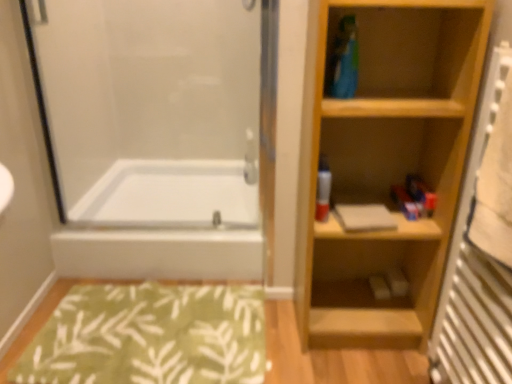
I want to click on wooden radiator at right, so click(481, 250).

This screenshot has width=512, height=384. What do you see at coordinates (156, 135) in the screenshot?
I see `transparent glass screen door at left` at bounding box center [156, 135].

Describe the element at coordinates (150, 335) in the screenshot. I see `green fabric bath mat at lower left` at that location.

You are a GUI agent. You are given a task and a screenshot of the screen. Output one action in this format:
    pyautogui.click(x=<x>, y=<y>)
    Task: Click on the matte gray book at center
    
    Given the screenshot: What is the action you would take?
    pyautogui.click(x=364, y=217)

Considering the sizes of objects transparent glass screen door at left and white textured towel at right in the image provided, who is taller, transparent glass screen door at left or white textured towel at right?

With more height is transparent glass screen door at left.

Is transparent glass screen door at left in front of white textured towel at right?

No.

From the image's perspective, relative to white textured towel at right, is transparent glass screen door at left above or below?

transparent glass screen door at left is above white textured towel at right.

Which is more to the left, transparent glass screen door at left or white textured towel at right?

From the viewer's perspective, transparent glass screen door at left appears more on the left side.

Consider the image. Can you confirm if white textured towel at right is thinner than light wood bookshelf at right?

Yes.

Find the location of a particular element. This screenshot has height=384, width=512. bath towel in front of the light wood bookshelf at right is located at coordinates (495, 186).

Considering the relative sizes of white textured towel at right and light wood bookshelf at right in the image provided, is white textured towel at right smaller than light wood bookshelf at right?

Yes, white textured towel at right is smaller than light wood bookshelf at right.

Who is more distant, white textured towel at right or light wood bookshelf at right?

light wood bookshelf at right is more distant.

Considering the relative positions of white glossy bathtub at lower left and matte plastic spray can at center in the image provided, is white glossy bathtub at lower left to the left of matte plastic spray can at center from the viewer's perspective?

Yes.

Between point (83, 263) and point (330, 183), which one is positioned behind?

Positioned behind is point (83, 263).

Considering their positions, is light wood bookshelf at right located in front of or behind matte plastic spray can at center?

Visually, light wood bookshelf at right is located in front of matte plastic spray can at center.

From the image's perspective, is light wood bookshelf at right located above matte plastic spray can at center?

No, from the image's perspective, light wood bookshelf at right is not over matte plastic spray can at center.

In terms of size, does light wood bookshelf at right appear bigger or smaller than matte plastic spray can at center?

light wood bookshelf at right is bigger than matte plastic spray can at center.

From the image's perspective, is wooden radiator at right under light wood bookshelf at right?

Yes, from the image's perspective, wooden radiator at right is below light wood bookshelf at right.

Considering the sizes of wooden radiator at right and light wood bookshelf at right in the image, is wooden radiator at right bigger or smaller than light wood bookshelf at right?

Clearly, wooden radiator at right is smaller in size than light wood bookshelf at right.

From a real-world perspective, which object stands above the other?

wooden radiator at right, from a real-world perspective.

The image size is (512, 384). I want to click on radiator below the light wood bookshelf at right (from the image's perspective), so click(481, 250).

Is transparent glass screen door at left in front of or behind green fabric bath mat at lower left in the image?

transparent glass screen door at left is behind green fabric bath mat at lower left.

From a real-world perspective, is transparent glass screen door at left above or below green fabric bath mat at lower left?

transparent glass screen door at left is situated higher than green fabric bath mat at lower left in the real world.

Is transparent glass screen door at left spatially inside green fabric bath mat at lower left, or outside of it?

transparent glass screen door at left is outside green fabric bath mat at lower left.

Is green fabric bath mat at lower left bigger than matte gray book at center?

Indeed, green fabric bath mat at lower left has a larger size compared to matte gray book at center.

Image resolution: width=512 pixels, height=384 pixels. In order to click on bath mat on the left of matte gray book at center in this screenshot , I will do `click(150, 335)`.

Which object is wider, green fabric bath mat at lower left or matte gray book at center?

green fabric bath mat at lower left.

Are green fabric bath mat at lower left and matte gray book at center making contact?

green fabric bath mat at lower left is not next to matte gray book at center, and they're not touching.

Where is `screen door lying above the white textured towel at right (from the image's perspective)`? The height and width of the screenshot is (384, 512). screen door lying above the white textured towel at right (from the image's perspective) is located at coordinates (156, 135).

Locate an element on the screen. bath towel that is in front of the light wood bookshelf at right is located at coordinates (495, 186).

Based on the photo, when comparing their distances from light wood bookshelf at right, does matte plastic spray can at center or transparent glass screen door at left seem further?

Based on the image, transparent glass screen door at left appears to be further to light wood bookshelf at right.

Estimate the real-world distances between objects in this image. Which object is further from green fabric bath mat at lower left, transparent glass screen door at left or white glossy bathtub at lower left?

The object further to green fabric bath mat at lower left is transparent glass screen door at left.

Looking at the image, which one is located closer to matte gray book at center, white glossy bathtub at lower left or white textured towel at right?

The object closer to matte gray book at center is white textured towel at right.

From the picture: Estimate the real-world distances between objects in this image. Which object is further from matte gray book at center, white glossy bathtub at lower left or matte plastic spray can at center?

white glossy bathtub at lower left is positioned further to the anchor matte gray book at center.

In the scene shown: Looking at the image, which one is located closer to matte gray book at center, white glossy bathtub at lower left or wooden radiator at right?

wooden radiator at right is positioned closer to the anchor matte gray book at center.

Which object lies further to the anchor point white textured towel at right, wooden radiator at right or transparent glass screen door at left?

transparent glass screen door at left is positioned further to the anchor white textured towel at right.

Which object lies nearer to the anchor point transparent glass screen door at left, matte plastic spray can at center or matte gray book at center?

matte plastic spray can at center lies closer to transparent glass screen door at left than the other object.

When comparing their distances from transparent glass screen door at left, does matte gray book at center or green fabric bath mat at lower left seem further?

matte gray book at center.

Where is `book between transparent glass screen door at left and white textured towel at right in the horizontal direction`? The image size is (512, 384). book between transparent glass screen door at left and white textured towel at right in the horizontal direction is located at coordinates (364, 217).

Identify the location of bath towel positioned between wooden radiator at right and matte gray book at center from near to far. The height and width of the screenshot is (384, 512). (495, 186).

The height and width of the screenshot is (384, 512). Find the location of `book between white glossy bathtub at lower left and light wood bookshelf at right`. book between white glossy bathtub at lower left and light wood bookshelf at right is located at coordinates (364, 217).

I want to click on bookshelf between wooden radiator at right and matte gray book at center from front to back, so click(x=386, y=164).